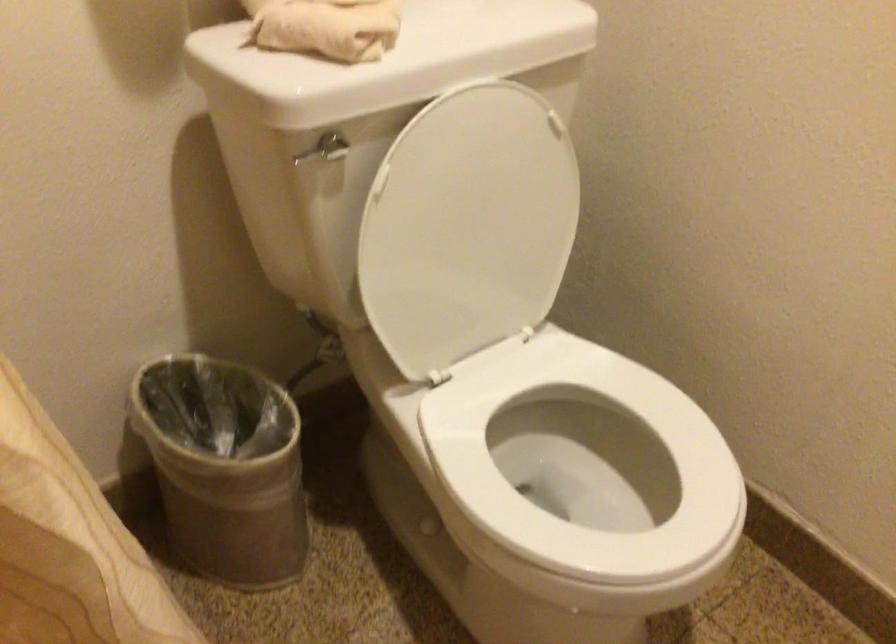
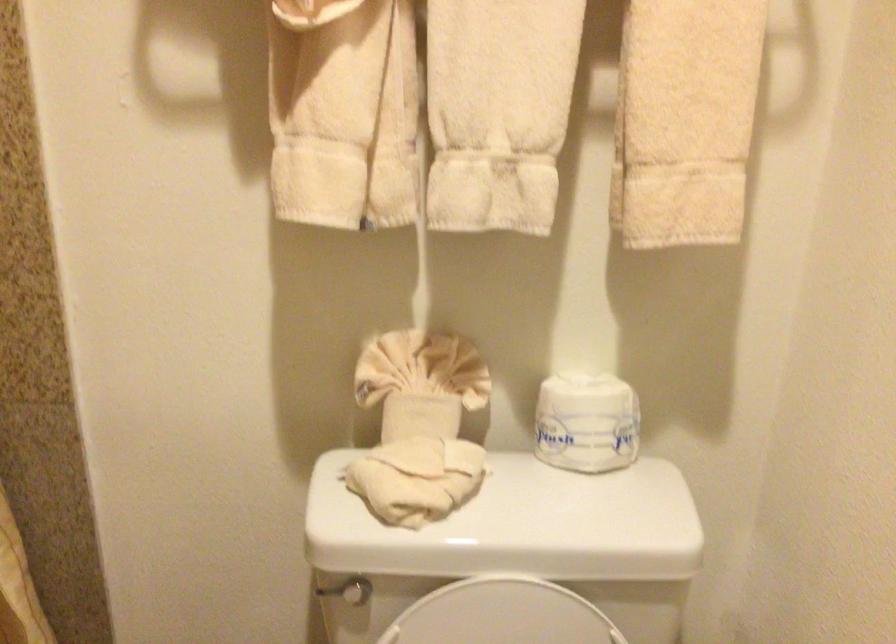
Question: The camera is either moving clockwise (left) or counter-clockwise (right) around the object. The first image is from the beginning of the video and the second image is from the end. Is the camera moving left or right when shooting the video?

Choices:
 (A) Left
 (B) Right

Answer: (B)